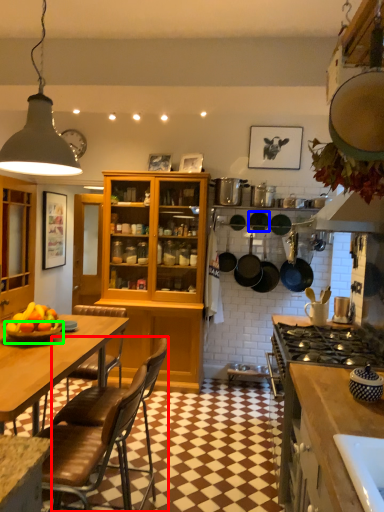
Question: Which object is positioned farthest from chair (highlighted by a red box)? Select from frying pan (highlighted by a blue box) and bowl (highlighted by a green box).

Choices:
 (A) frying pan
 (B) bowl

Answer: (A)